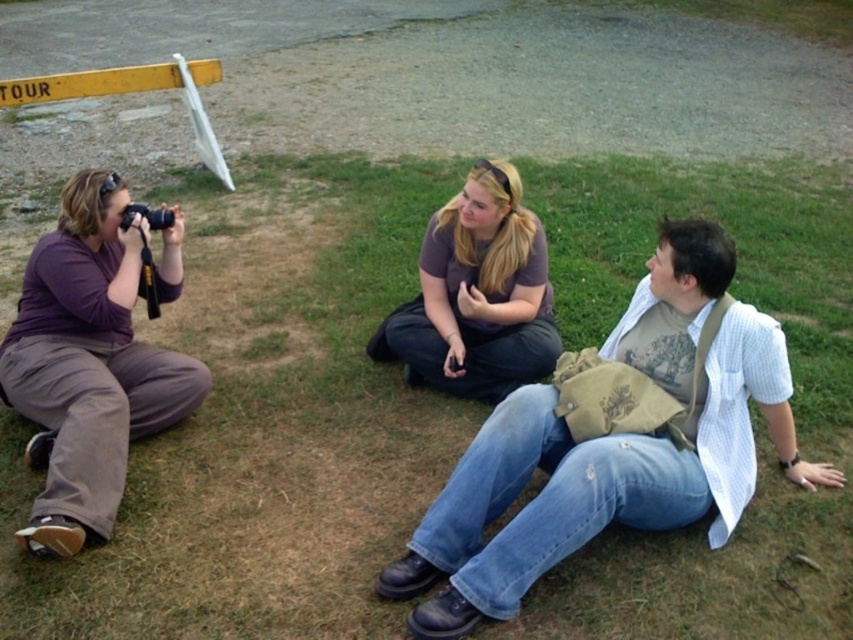
You are a photographer trying to capture a photo of both the matte purple shirt at left and the purple cotton shirt at center. Based on their positions, which one is lower in the frame?

The matte purple shirt at left is below the purple cotton shirt at center, so the matte purple shirt at left is lower in the frame.

You are a photographer trying to capture a clear image of the purple cotton shirt at center and the black plastic camera at left. Which object should you focus on first if you want to ensure both are in focus, considering their sizes?

The purple cotton shirt at center has a larger size compared to the black plastic camera at left, so you should focus on the purple cotton shirt at center first to ensure both are in focus.